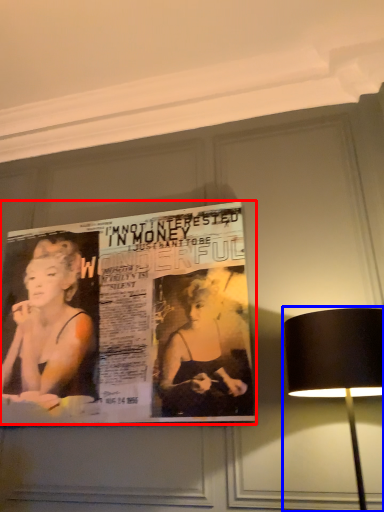
Question: Among these objects, which one is farthest to the camera, poster (highlighted by a red box) or lamp (highlighted by a blue box)?

Choices:
 (A) poster
 (B) lamp

Answer: (A)